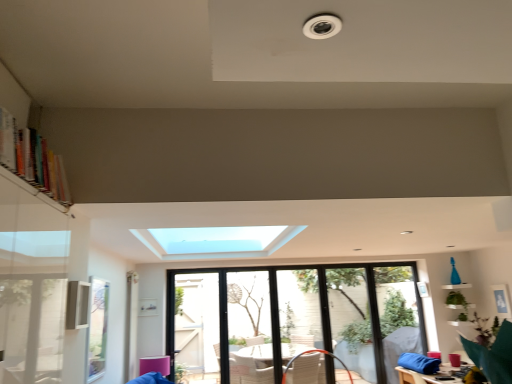
Where is `clear glass window at center`? This screenshot has width=512, height=384. clear glass window at center is located at coordinates (290, 317).

This screenshot has width=512, height=384. Identify the location of multicolored wooden bookshelf at upper left. (32, 159).

Find the location of a particular element. The image size is (512, 384). transparent glass screen door at center, which appears as the 2th screen door when viewed from the left is located at coordinates (249, 327).

In the scene shown: Which is more to the left, clear glass window screen at lower left or multicolored wooden bookshelf at upper left?

From the viewer's perspective, clear glass window screen at lower left appears more on the left side.

From the image's perspective, is clear glass window screen at lower left located above or below multicolored wooden bookshelf at upper left?

Based on their image positions, clear glass window screen at lower left is located beneath multicolored wooden bookshelf at upper left.

Who is bigger, clear glass window screen at lower left or multicolored wooden bookshelf at upper left?

With larger size is multicolored wooden bookshelf at upper left.

Is transparent glass screen door at center, which appears as the 2th screen door when viewed from the left, located within transparent glass screen door at center, which ranks as the second screen door in right-to-left order?

No, transparent glass screen door at center, which appears as the 2th screen door when viewed from the left, is located outside of transparent glass screen door at center, which ranks as the second screen door in right-to-left order.

From a real-world perspective, does transparent glass screen door at center, the first screen door in the left-to-right sequence, stand above transparent glass screen door at center, which appears as the 2th screen door when viewed from the left?

Yes, from a real-world perspective, transparent glass screen door at center, the first screen door in the left-to-right sequence, is above transparent glass screen door at center, which appears as the 2th screen door when viewed from the left.

Does transparent glass screen door at center, which ranks as the second screen door in right-to-left order, come behind transparent glass screen door at center, which appears as the 2th screen door when viewed from the left?

No, transparent glass screen door at center, which ranks as the second screen door in right-to-left order, is in front of transparent glass screen door at center, which appears as the 2th screen door when viewed from the left.

From the image's perspective, between transparent glass screen door at center, the first screen door in the left-to-right sequence, and transparent glass screen door at center, which appears as the 2th screen door when viewed from the left, who is located below?

transparent glass screen door at center, which appears as the 2th screen door when viewed from the left, is shown below in the image.

Which of these two, transparent glass screen door at center, which appears as the 2th screen door when viewed from the left, or multicolored wooden bookshelf at upper left, stands shorter?

With less height is multicolored wooden bookshelf at upper left.

Is transparent glass screen door at center, which appears as the 2th screen door when viewed from the left, oriented away from multicolored wooden bookshelf at upper left?

No, transparent glass screen door at center, which appears as the 2th screen door when viewed from the left, is not facing the opposite direction of multicolored wooden bookshelf at upper left.

Is point (230, 295) positioned in front of point (0, 129)?

No, (230, 295) is further to viewer.

Considering the positions of objects transparent glass screen door at center, which is the 1th screen door in right-to-left order, and multicolored wooden bookshelf at upper left in the image provided, who is in front, transparent glass screen door at center, which is the 1th screen door in right-to-left order, or multicolored wooden bookshelf at upper left?

multicolored wooden bookshelf at upper left is in front.

Find the location of `bookshelf positioned vertically above the transparent glass screen door at center, the first screen door in the left-to-right sequence (from a real-world perspective)`. bookshelf positioned vertically above the transparent glass screen door at center, the first screen door in the left-to-right sequence (from a real-world perspective) is located at coordinates coord(32,159).

Based on the photo, from the image's perspective, is transparent glass screen door at center, the first screen door in the left-to-right sequence, below multicolored wooden bookshelf at upper left?

Yes, from the image's perspective, transparent glass screen door at center, the first screen door in the left-to-right sequence, is beneath multicolored wooden bookshelf at upper left.

Is transparent glass screen door at center, which ranks as the second screen door in right-to-left order, positioned far away from multicolored wooden bookshelf at upper left?

Yes, transparent glass screen door at center, which ranks as the second screen door in right-to-left order, and multicolored wooden bookshelf at upper left are quite far apart.

Is transparent glass screen door at center, which ranks as the second screen door in right-to-left order, to the right of multicolored wooden bookshelf at upper left from the viewer's perspective?

Yes, transparent glass screen door at center, which ranks as the second screen door in right-to-left order, is to the right of multicolored wooden bookshelf at upper left.

Considering the sizes of objects multicolored wooden bookshelf at upper left and transparent glass screen door at center, which appears as the 2th screen door when viewed from the left, in the image provided, who is shorter, multicolored wooden bookshelf at upper left or transparent glass screen door at center, which appears as the 2th screen door when viewed from the left,?

With less height is multicolored wooden bookshelf at upper left.

Between multicolored wooden bookshelf at upper left and transparent glass screen door at center, which appears as the 2th screen door when viewed from the left, which one appears on the right side from the viewer's perspective?

Positioned to the right is transparent glass screen door at center, which appears as the 2th screen door when viewed from the left.

Is multicolored wooden bookshelf at upper left placed right next to transparent glass screen door at center, which is the 1th screen door in right-to-left order?

No, multicolored wooden bookshelf at upper left is not next to transparent glass screen door at center, which is the 1th screen door in right-to-left order.

Looking at this image, is transparent glass screen door at center, which is the 1th screen door in right-to-left order, at the back of multicolored wooden bookshelf at upper left?

No, multicolored wooden bookshelf at upper left is not facing the opposite direction of transparent glass screen door at center, which is the 1th screen door in right-to-left order.

Does point (98, 282) appear closer or farther from the camera than point (217, 381)?

Clearly, point (98, 282) is closer to the camera than point (217, 381).

From a real-world perspective, does clear glass window screen at lower left stand above transparent glass screen door at center, the first screen door in the left-to-right sequence?

Yes, from a real-world perspective, clear glass window screen at lower left is on top of transparent glass screen door at center, the first screen door in the left-to-right sequence.

In terms of size, does clear glass window screen at lower left appear bigger or smaller than transparent glass screen door at center, which ranks as the second screen door in right-to-left order?

Considering their sizes, clear glass window screen at lower left takes up less space than transparent glass screen door at center, which ranks as the second screen door in right-to-left order.

Is clear glass window screen at lower left turned away from transparent glass screen door at center, the first screen door in the left-to-right sequence?

clear glass window screen at lower left is not turned away from transparent glass screen door at center, the first screen door in the left-to-right sequence.

Between multicolored wooden bookshelf at upper left and clear glass window at center, which one has smaller size?

multicolored wooden bookshelf at upper left.

Does multicolored wooden bookshelf at upper left have a greater width compared to clear glass window at center?

Indeed, multicolored wooden bookshelf at upper left has a greater width compared to clear glass window at center.

From a real-world perspective, which object stands above the other?

multicolored wooden bookshelf at upper left, from a real-world perspective.

At what (x,y) coordinates should I click in order to perform the action: click on bookshelf positioned vertically above the clear glass window screen at lower left (from a real-world perspective). Please return your answer as a coordinate pair (x, y). Looking at the image, I should click on (32, 159).

This screenshot has width=512, height=384. Identify the location of screen door lying in front of the transparent glass screen door at center, which is the 1th screen door in right-to-left order. (194, 327).

From the image, which object appears to be nearer to transparent glass screen door at center, which ranks as the second screen door in right-to-left order, multicolored wooden bookshelf at upper left or transparent glass screen door at center, which is the 1th screen door in right-to-left order?

Among the two, transparent glass screen door at center, which is the 1th screen door in right-to-left order, is located nearer to transparent glass screen door at center, which ranks as the second screen door in right-to-left order.

Considering their positions, is clear glass window screen at lower left positioned closer to multicolored wooden bookshelf at upper left than transparent glass screen door at center, the first screen door in the left-to-right sequence?

clear glass window screen at lower left.

When comparing their distances from clear glass window at center, does transparent glass screen door at center, which appears as the 2th screen door when viewed from the left, or multicolored wooden bookshelf at upper left seem closer?

transparent glass screen door at center, which appears as the 2th screen door when viewed from the left, lies closer to clear glass window at center than the other object.

From the image, which object appears to be farther from clear glass window screen at lower left, multicolored wooden bookshelf at upper left or transparent glass screen door at center, which ranks as the second screen door in right-to-left order?

transparent glass screen door at center, which ranks as the second screen door in right-to-left order, is further to clear glass window screen at lower left.

Based on their spatial positions, is transparent glass screen door at center, which appears as the 2th screen door when viewed from the left, or multicolored wooden bookshelf at upper left further from clear glass window screen at lower left?

transparent glass screen door at center, which appears as the 2th screen door when viewed from the left, lies further to clear glass window screen at lower left than the other object.

Which object lies further to the anchor point transparent glass screen door at center, the first screen door in the left-to-right sequence, clear glass window at center or clear glass window screen at lower left?

clear glass window screen at lower left is further to transparent glass screen door at center, the first screen door in the left-to-right sequence.

Based on their spatial positions, is clear glass window at center or transparent glass screen door at center, which ranks as the second screen door in right-to-left order, further from multicolored wooden bookshelf at upper left?

clear glass window at center.

Estimate the real-world distances between objects in this image. Which object is further from transparent glass screen door at center, which ranks as the second screen door in right-to-left order, multicolored wooden bookshelf at upper left or clear glass window at center?

Based on the image, multicolored wooden bookshelf at upper left appears to be further to transparent glass screen door at center, which ranks as the second screen door in right-to-left order.

This screenshot has width=512, height=384. What are the coordinates of `screen door situated between transparent glass screen door at center, the first screen door in the left-to-right sequence, and clear glass window at center from left to right` in the screenshot? It's located at (249, 327).

Locate an element on the screen. screen door between multicolored wooden bookshelf at upper left and transparent glass screen door at center, which is the 1th screen door in right-to-left order, from front to back is located at coordinates (194, 327).

Where is `window screen located between multicolored wooden bookshelf at upper left and clear glass window at center in the depth direction`? This screenshot has width=512, height=384. window screen located between multicolored wooden bookshelf at upper left and clear glass window at center in the depth direction is located at coordinates (97, 329).

The width and height of the screenshot is (512, 384). Find the location of `window screen between multicolored wooden bookshelf at upper left and transparent glass screen door at center, which ranks as the second screen door in right-to-left order, along the z-axis`. window screen between multicolored wooden bookshelf at upper left and transparent glass screen door at center, which ranks as the second screen door in right-to-left order, along the z-axis is located at coordinates 97,329.